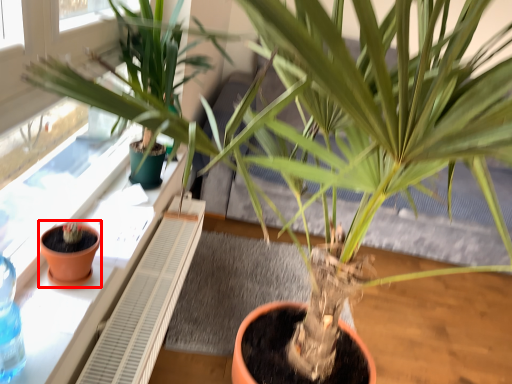
Question: From the image's perspective, what is the correct spatial positioning of flowerpot (annotated by the red box) in reference to window sill?

Choices:
 (A) above
 (B) below

Answer: (B)